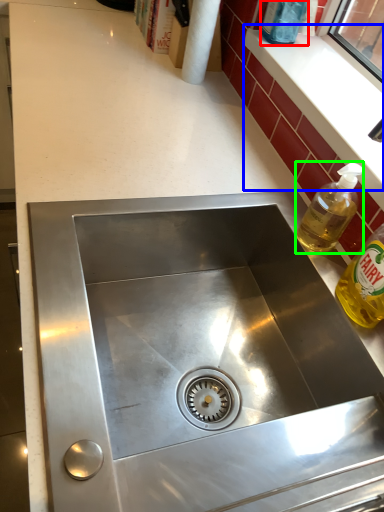
Question: Which is nearer to the bottle (highlighted by a red box)? window sill (highlighted by a blue box) or bottle (highlighted by a green box).

Choices:
 (A) window sill
 (B) bottle

Answer: (A)